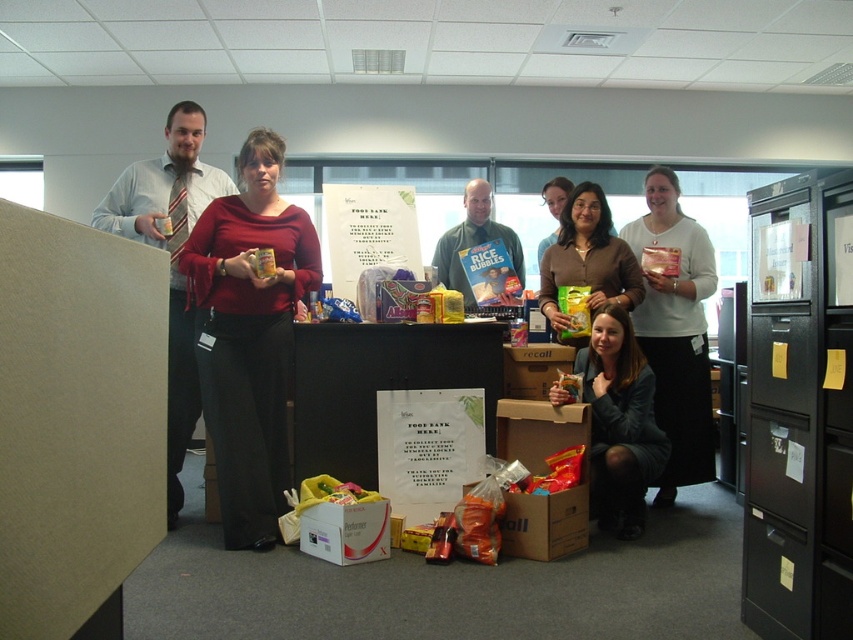
You are organizing a photo shoot and need to position two items on a shelf. The matte red sweater at center and the matte black jacket at lower center must be placed such that their heights are accurately represented. Which item should you place higher on the shelf to maintain their height relationship?

The matte red sweater at center should be placed higher on the shelf than the matte black jacket at lower center since it has a greater height according to the description.

You are organizing a food drive and need to place a sign on the tallest object in the scene. Which object should you choose between the black metal file cabinet at right and the matte green shirt at center?

The black metal file cabinet at right is taller than the matte green shirt at center, so you should place the sign on the black metal file cabinet at right.

You are organizing a food drive and need to place a cardboard sign at center and a white cardboard box at center on a table. If you want to ensure the sign is visible to people entering the room, which object should be placed closer to the entrance?

The cardboard sign at center should be placed closer to the entrance because its width surpasses that of the white cardboard box at center, making it more noticeable.